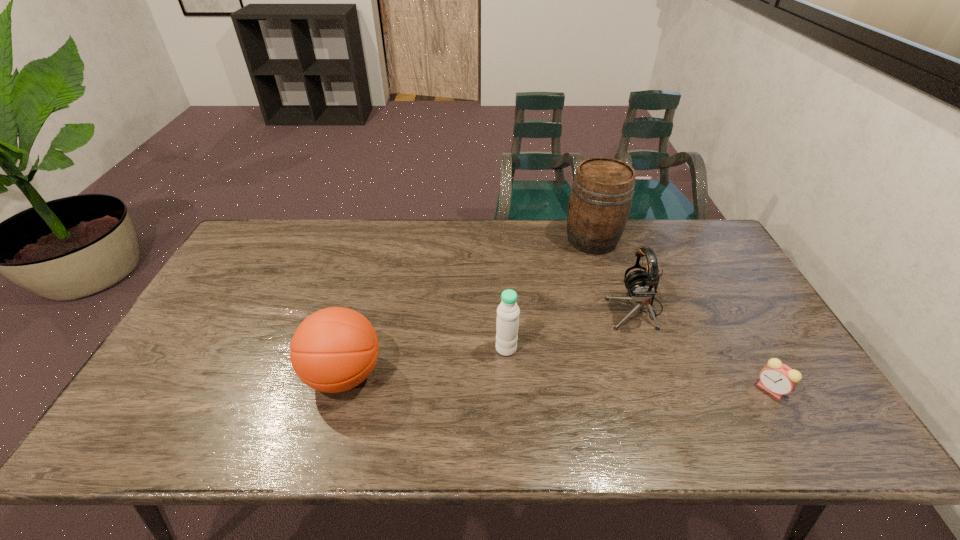
In the image, there is a desktop. In order to click on vacant space at the left edge in this screenshot , I will do `click(253, 271)`.

Where is `vacant space at the right edge`? The image size is (960, 540). vacant space at the right edge is located at coordinates (698, 278).

The height and width of the screenshot is (540, 960). In the image, there is a desktop. In order to click on free region at the near left corner in this screenshot , I will do `click(125, 447)`.

Where is `vacant space at the far right corner`? Image resolution: width=960 pixels, height=540 pixels. vacant space at the far right corner is located at coordinates (674, 231).

In the image, there is a desktop. Where is `vacant space at the near right corner`? Image resolution: width=960 pixels, height=540 pixels. vacant space at the near right corner is located at coordinates (804, 415).

Find the location of a particular element. empty location between the water bottle and the shortest object is located at coordinates (638, 369).

Locate an element on the screen. blank region between the tallest object and the rightmost object is located at coordinates (682, 314).

You are a GUI agent. You are given a task and a screenshot of the screen. Output one action in this format:
    pyautogui.click(x=<x>, y=<y>)
    Task: Click on the empty space between the leftmost object and the earphone
    
    Given the screenshot: What is the action you would take?
    pyautogui.click(x=490, y=342)

Where is `vacant region between the second farthest object and the leftmost object`? vacant region between the second farthest object and the leftmost object is located at coordinates (490, 342).

Identify the location of vacant point located between the water bottle and the fourth nearest object. (571, 329).